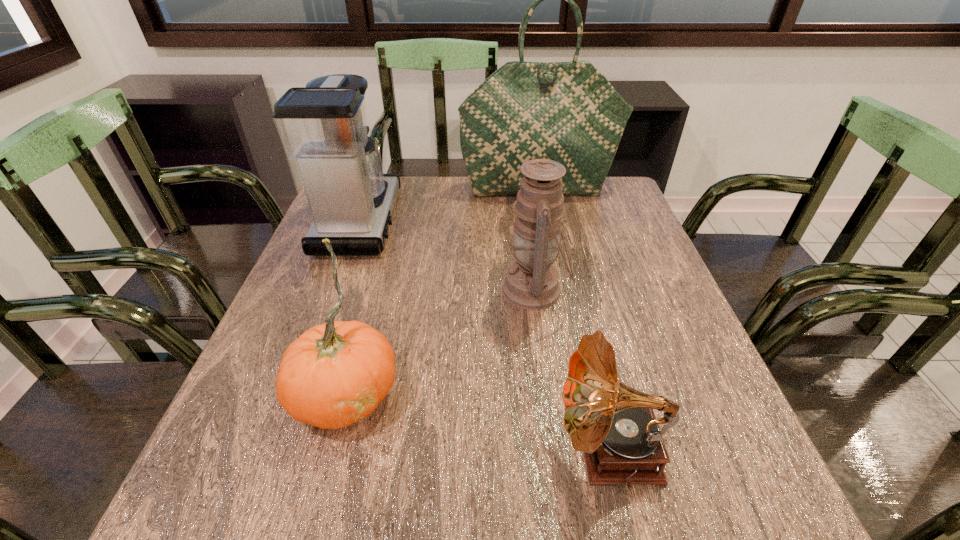
I want to click on free spot located 0.050m on the horn of the phonograph_record, so click(526, 449).

You are a GUI agent. You are given a task and a screenshot of the screen. Output one action in this format:
    pyautogui.click(x=<x>, y=<y>)
    Task: Click on the free space located 0.260m on the horn of the phonograph_record
    
    Given the screenshot: What is the action you would take?
    pyautogui.click(x=396, y=449)

Locate an element on the screen. Image resolution: width=960 pixels, height=540 pixels. tote bag that is at the far edge is located at coordinates (568, 112).

Locate an element on the screen. The image size is (960, 540). coffee maker present at the far edge is located at coordinates (323, 127).

Identify the location of object present at the near edge. (614, 424).

The height and width of the screenshot is (540, 960). In order to click on coffee maker present at the left edge in this screenshot , I will do `click(323, 127)`.

The height and width of the screenshot is (540, 960). I want to click on pumpkin that is at the left edge, so click(x=334, y=374).

Image resolution: width=960 pixels, height=540 pixels. Identify the location of tote bag situated at the right edge. (568, 112).

Image resolution: width=960 pixels, height=540 pixels. I want to click on phonograph_record present at the right edge, so click(614, 424).

The width and height of the screenshot is (960, 540). What are the coordinates of `object located in the far left corner section of the desktop` in the screenshot? It's located at click(x=323, y=127).